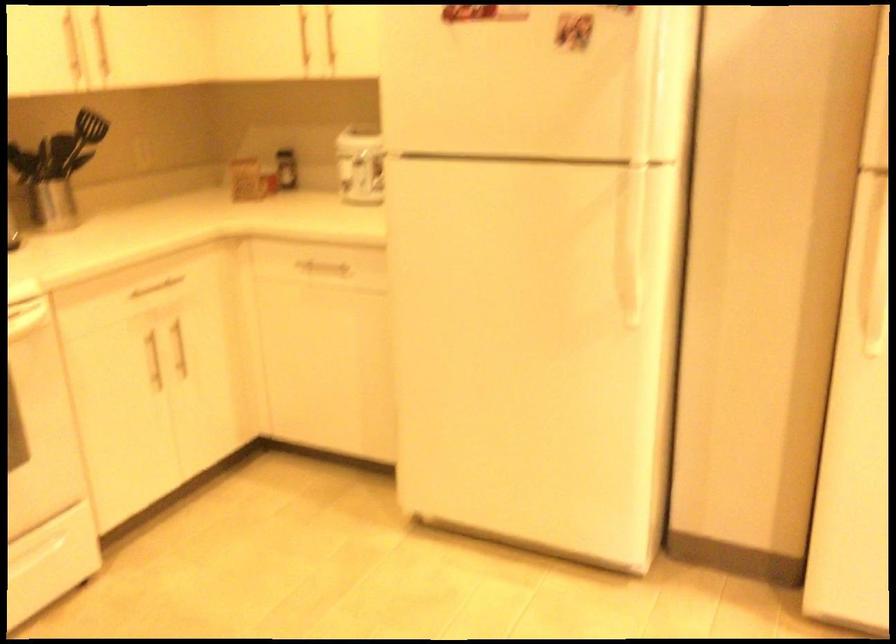
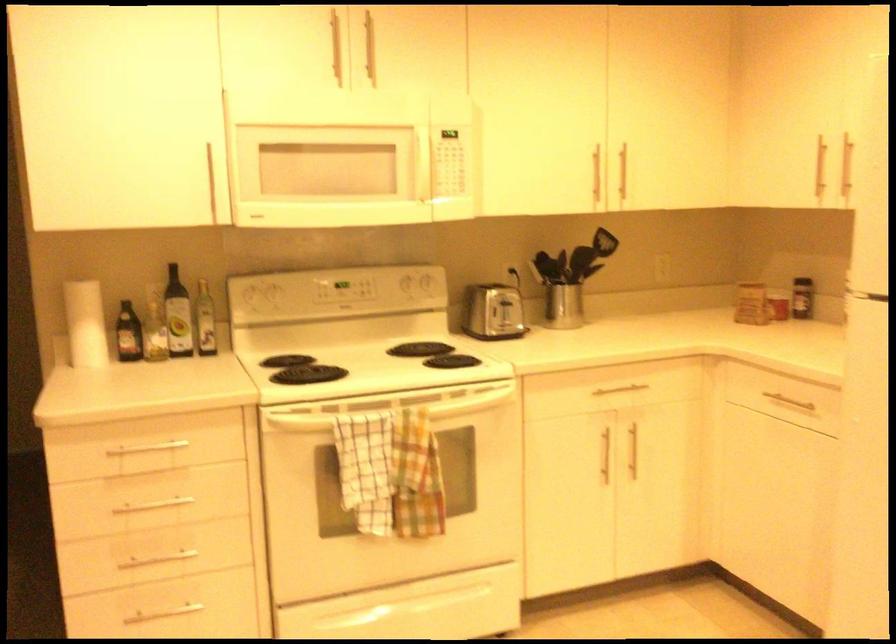
The point at [290,172] is marked in the first image. Where is the corresponding point in the second image?

(802, 298)